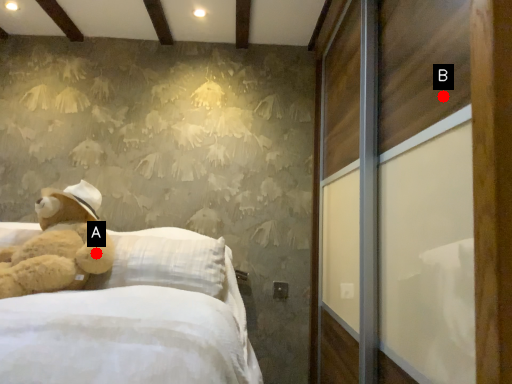
Question: Two points are circled on the image, labeled by A and B beside each circle. Which point is closer to the camera?

Choices:
 (A) A is closer
 (B) B is closer

Answer: (B)